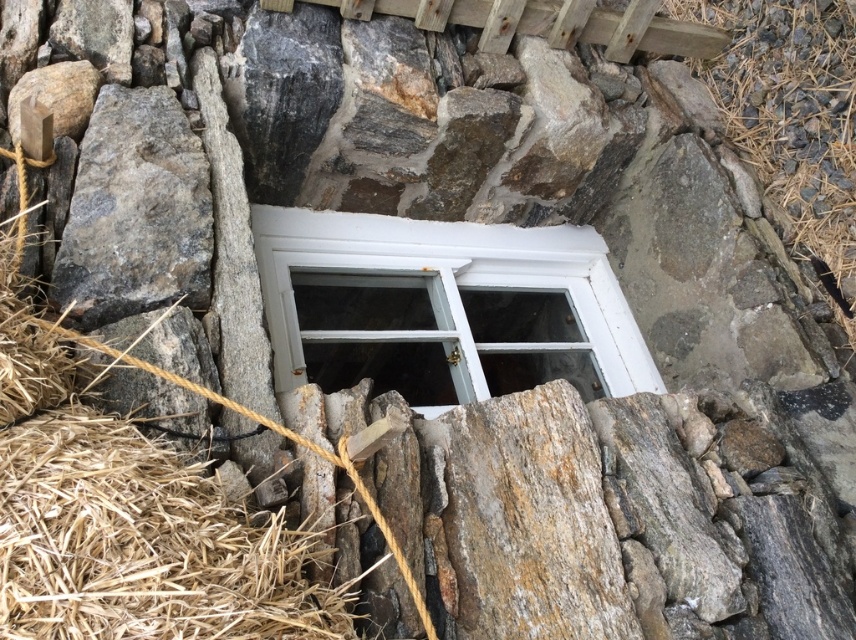
Based on the photo, you are standing in front of the stone wall with the white window. There are two points marked on the wall at coordinates point (0, 508) and point (407, 230). Which point is nearer to your eyes?

Point (0, 508) is closer to the camera than point (407, 230), so the point nearer to your eyes is point (0, 508).

You are a painter standing at the base of the stone wall. You need to paint the white painted wood window at center, but there is brown straw at lower left in the way. Can you paint the window without moving the straw?

The brown straw at lower left is taller than the white painted wood window at center, so the straw is blocking the view of the window. You will need to move the straw to paint the window properly.

You are standing in front of the stone wall with the small window. You notice brown straw at lower left and gray rough stone at left. Which object is nearer to you?

The brown straw at lower left is closer to the viewer than the gray rough stone at left.